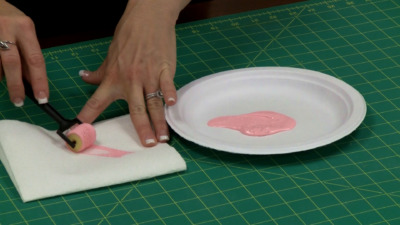
You are a GUI agent. You are given a task and a screenshot of the screen. Output one action in this format:
    pyautogui.click(x=<x>, y=<y>)
    Task: Click on the handle
    
    Given the screenshot: What is the action you would take?
    pyautogui.click(x=48, y=108)